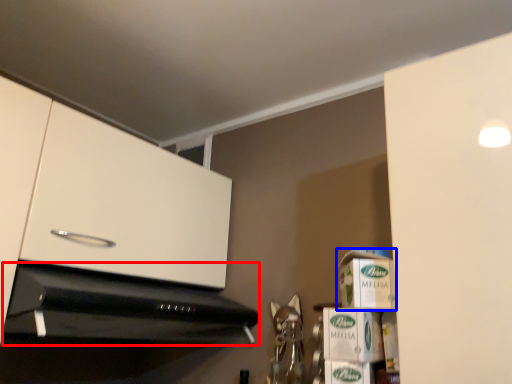
Question: Which point is closer to the camera, home appliance (highlighted by a red box) or cardboard box (highlighted by a blue box)?

Choices:
 (A) home appliance
 (B) cardboard box

Answer: (A)